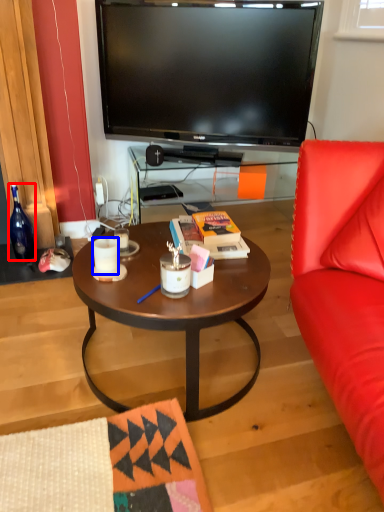
Question: Which of the following is the closest to the observer, bottle (highlighted by a red box) or coffee cup (highlighted by a blue box)?

Choices:
 (A) bottle
 (B) coffee cup

Answer: (B)